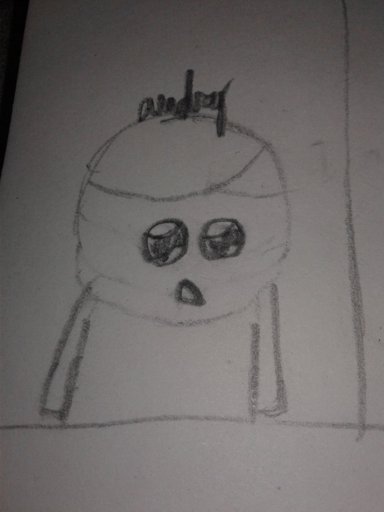
You are a GUI agent. You are given a task and a screenshot of the screen. Output one action in this format:
    pyautogui.click(x=<x>, y=<y>)
    Task: Click on the crayon marking
    
    Given the screenshot: What is the action you would take?
    pyautogui.click(x=178, y=417)